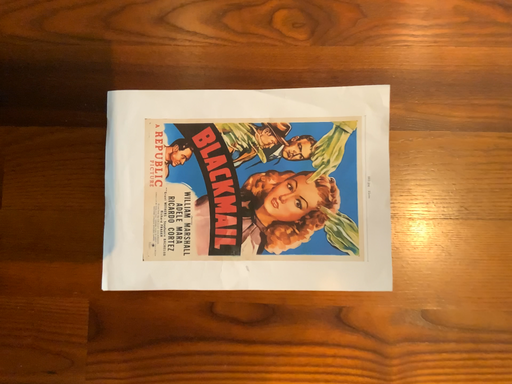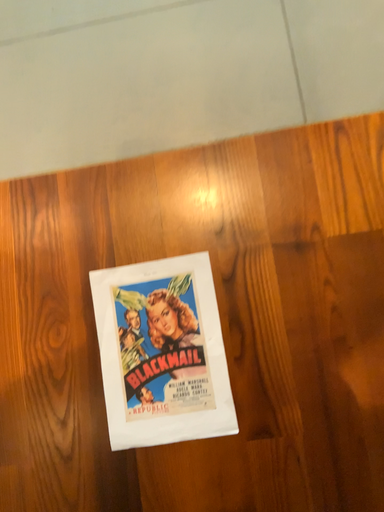
Question: How did the camera likely rotate when shooting the video?

Choices:
 (A) rotated downward
 (B) rotated upward

Answer: (B)